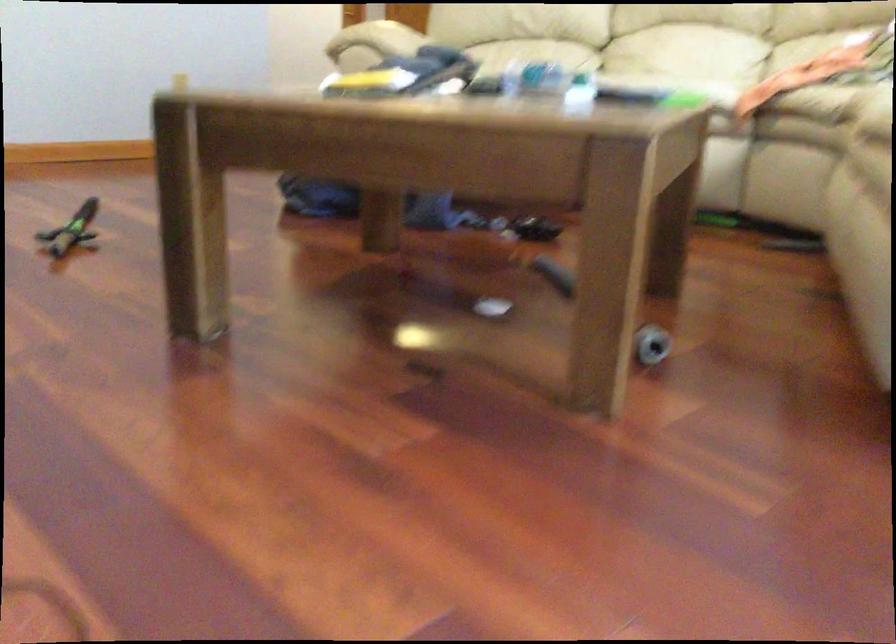
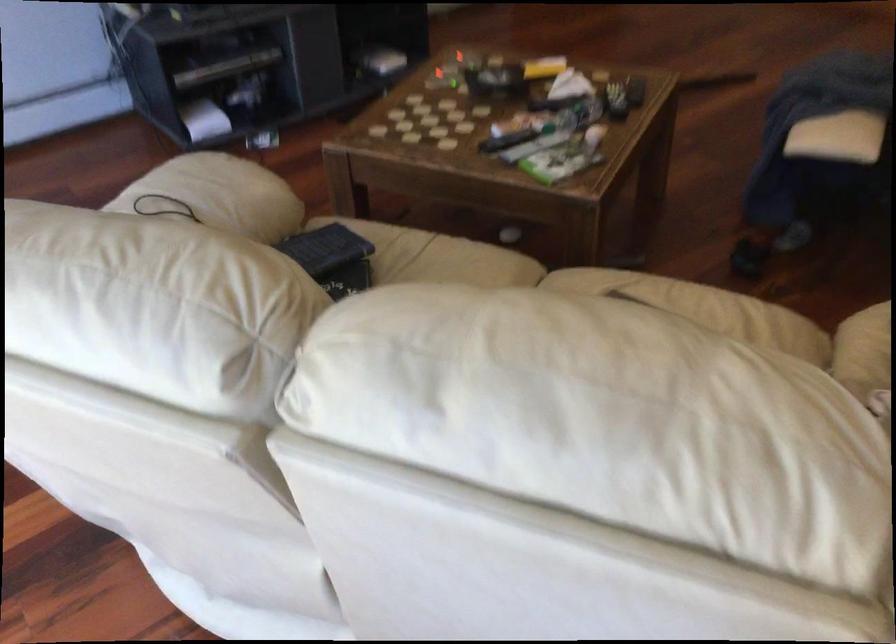
Question: I am providing you with two images of the same scene from different viewpoints. Please identify which objects are invisible in image2.

Choices:
 (A) black wire rack
 (B) small black keyboard
 (C) black remote control
 (D) green toy sword

Answer: (D)